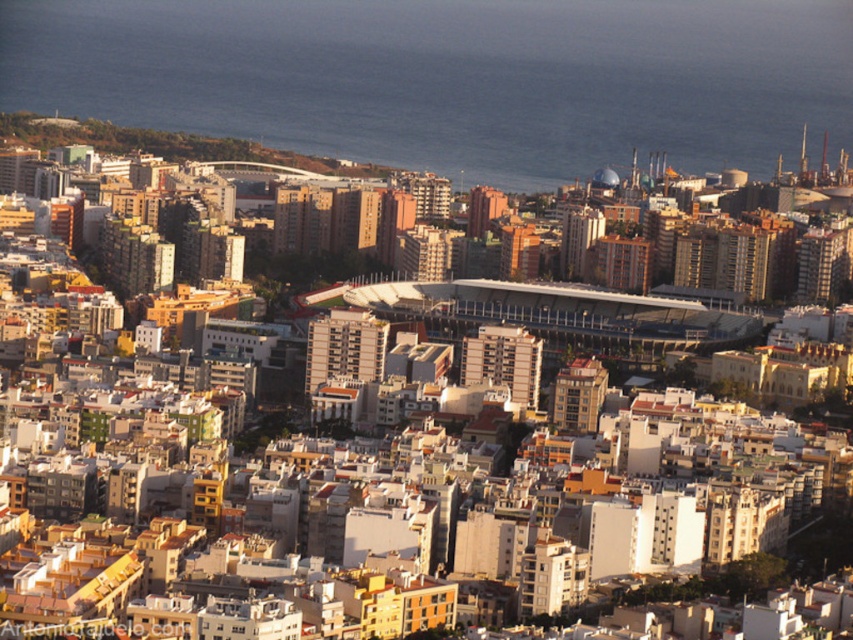
Does blue water at center have a lesser height compared to matte white dome at center?

In fact, blue water at center may be taller than matte white dome at center.

Can you confirm if blue water at center is taller than matte white dome at center?

Yes, blue water at center is taller than matte white dome at center.

This screenshot has width=853, height=640. Describe the element at coordinates (451, 77) in the screenshot. I see `blue water at center` at that location.

Locate an element on the screen. The height and width of the screenshot is (640, 853). blue water at center is located at coordinates (451, 77).